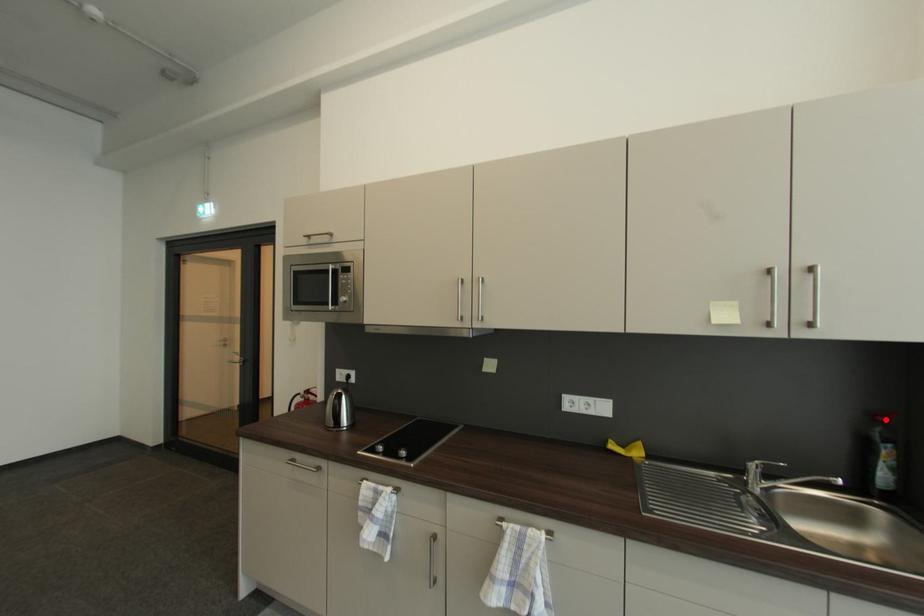
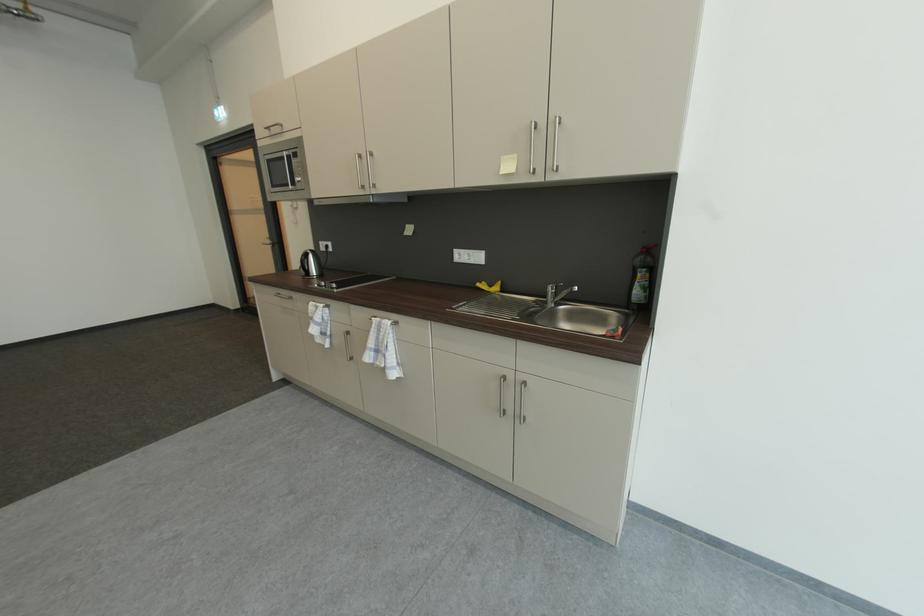
In the second image, find the point that corresponds to the highlighted location in the first image.

(650, 252)